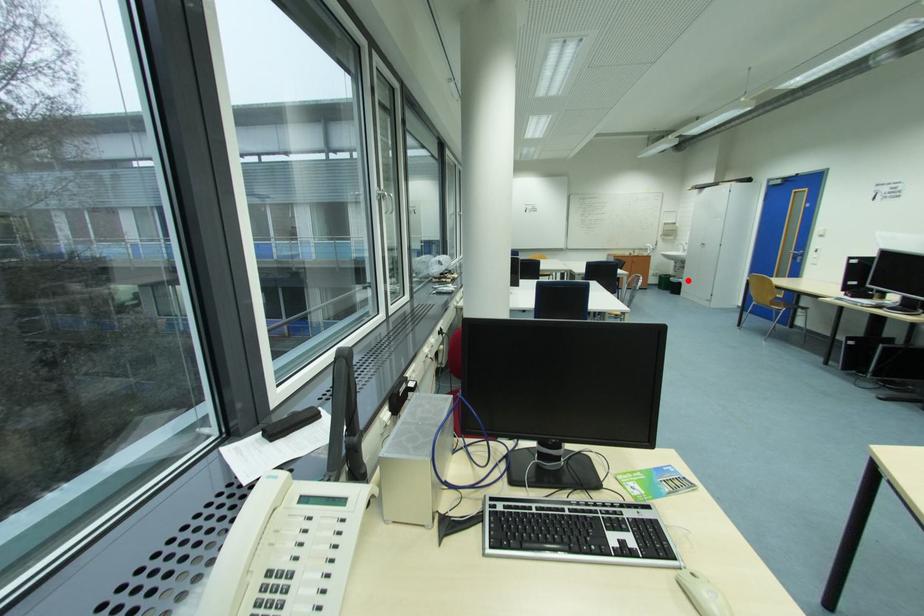
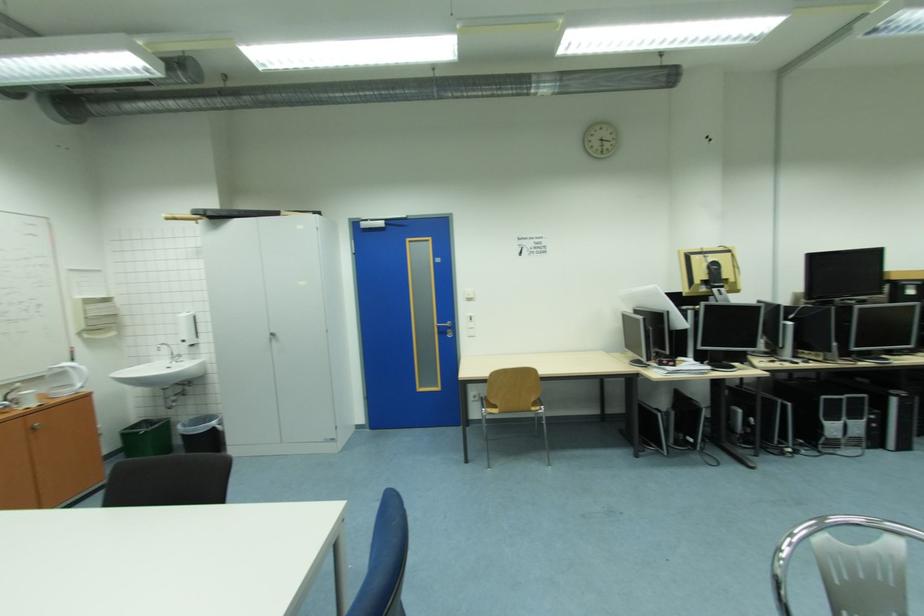
Question: I am providing you with two images of the same scene from different viewpoints. A red point is shown in image1. For the corresponding object point in image2, is it positioned nearer or farther from the camera?

Choices:
 (A) Nearer
 (B) Farther

Answer: (B)